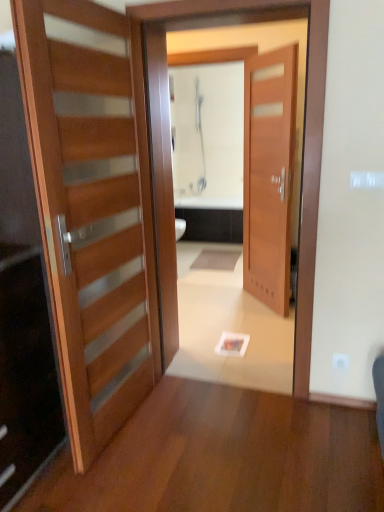
Locate an element on the screen. This screenshot has height=512, width=384. vacant area to the left of wooden door at center, which is the 1th door in back-to-front order is located at coordinates (226, 306).